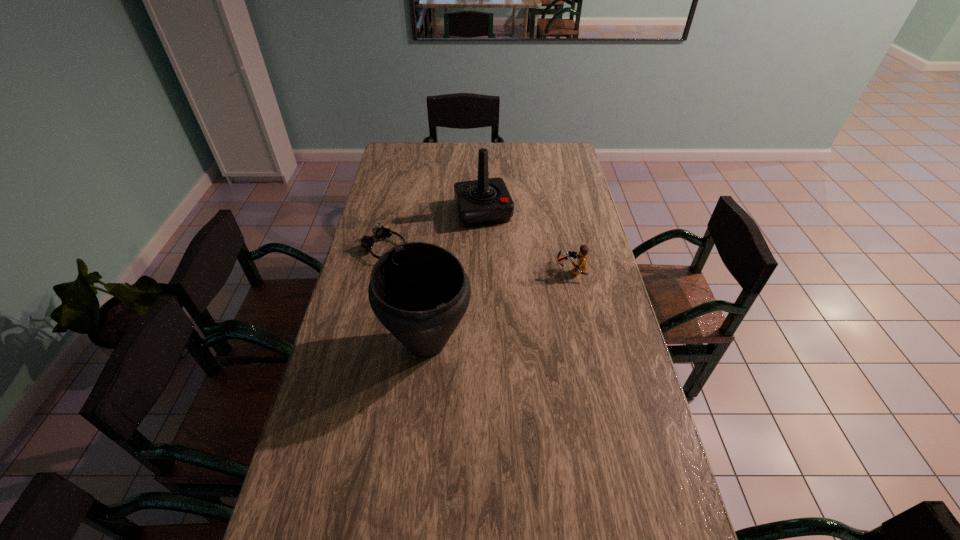
Find the location of `the nearest object`. the nearest object is located at coordinates (419, 291).

Locate an element on the screen. Image resolution: width=960 pixels, height=540 pixels. the rightmost object is located at coordinates (581, 257).

Find the location of `Lego`. Lego is located at coordinates (581, 257).

This screenshot has height=540, width=960. I want to click on the farthest object, so click(486, 201).

Locate an element on the screen. goggles is located at coordinates (379, 232).

Locate an element on the screen. The height and width of the screenshot is (540, 960). vacant space located on the front of the nearest object is located at coordinates (420, 407).

Find the location of a particular element. The width and height of the screenshot is (960, 540). free location located 0.050m holding a crossbow in the hands of the rightmost object is located at coordinates (542, 270).

You are a GUI agent. You are given a task and a screenshot of the screen. Output one action in this format:
    pyautogui.click(x=<x>, y=<y>)
    Task: Click on the free point located holding a crossbow in the hands of the rightmost object
    The height and width of the screenshot is (540, 960).
    Given the screenshot: What is the action you would take?
    pyautogui.click(x=477, y=270)

Image resolution: width=960 pixels, height=540 pixels. I want to click on free spot located holding a crossbow in the hands of the rightmost object, so click(522, 270).

Find the location of a particular element. The height and width of the screenshot is (540, 960). free location located on the front-facing side of the farthest object is located at coordinates (514, 296).